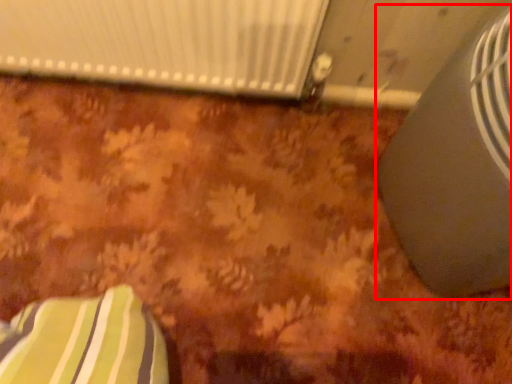
Question: From the image's perspective, considering the relative positions of air conditioning (annotated by the red box) and radiator in the image provided, where is air conditioning (annotated by the red box) located with respect to the staircase?

Choices:
 (A) above
 (B) below

Answer: (B)